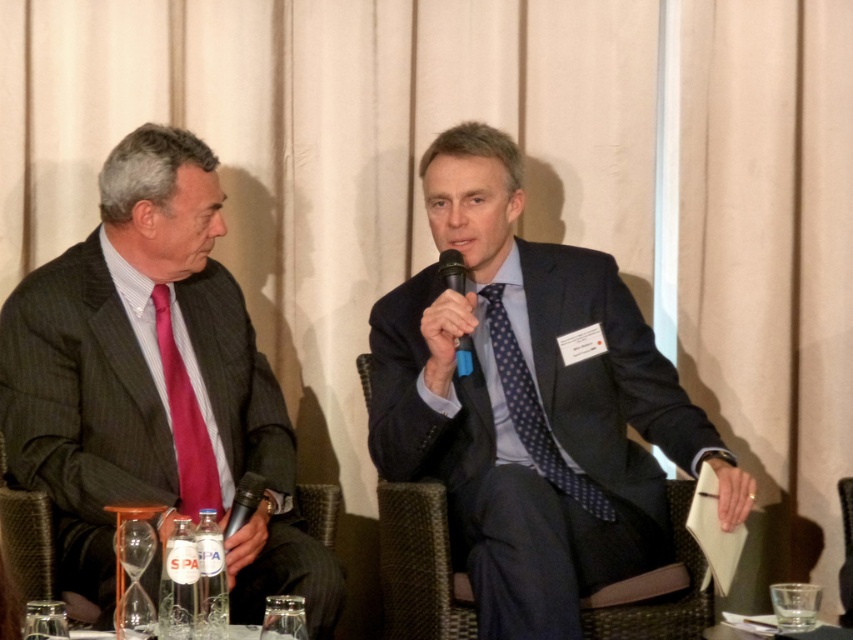
Who is higher up, matte black suit at left or clear glass at lower right?

matte black suit at left

The width and height of the screenshot is (853, 640). I want to click on matte black suit at left, so tap(154, 385).

Between point (25, 444) and point (756, 618), which one is positioned in front?

Point (756, 618) is in front.

Where is `matte black suit at left`? matte black suit at left is located at coordinates (154, 385).

Does matte black suit at center appear under black plastic microphone at center?

Correct, matte black suit at center is located below black plastic microphone at center.

Between point (554, 252) and point (466, 365), which one is positioned behind?

Positioned behind is point (554, 252).

This screenshot has width=853, height=640. What do you see at coordinates (531, 404) in the screenshot? I see `matte black suit at center` at bounding box center [531, 404].

In order to click on matte black suit at center in this screenshot , I will do `click(531, 404)`.

Does woven dark brown chair at center have a greater width compared to blue dotted tie at center?

No, woven dark brown chair at center is not wider than blue dotted tie at center.

Can you confirm if woven dark brown chair at center is positioned above blue dotted tie at center?

No, woven dark brown chair at center is not above blue dotted tie at center.

Is point (457, 627) behind point (531, 400)?

No.

In order to click on woven dark brown chair at center in this screenshot , I will do `click(418, 566)`.